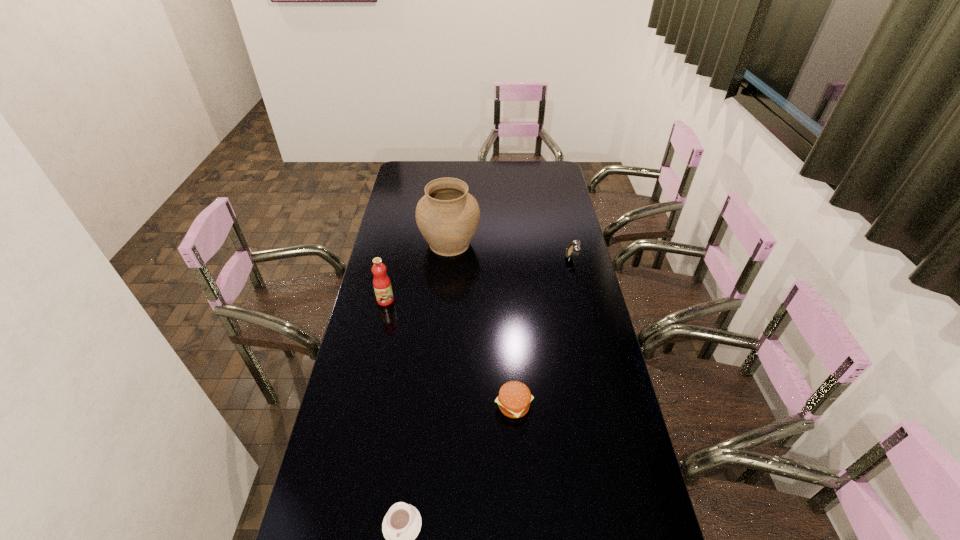
I want to click on free location that satisfies the following two spatial constraints: 1. on the front label of the leftmost object; 2. on the left side of the second object from right to left, so click(363, 406).

In order to click on free space that satisfies the following two spatial constraints: 1. on the face of the rightmost object; 2. on the front label of the leftmost object in this screenshot , I will do `click(582, 300)`.